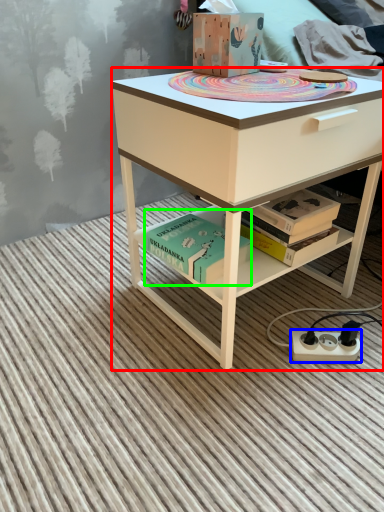
Question: Which is nearer to the desk (highlighted by a red box)? power plugs and sockets (highlighted by a blue box) or book (highlighted by a green box).

Choices:
 (A) power plugs and sockets
 (B) book

Answer: (B)